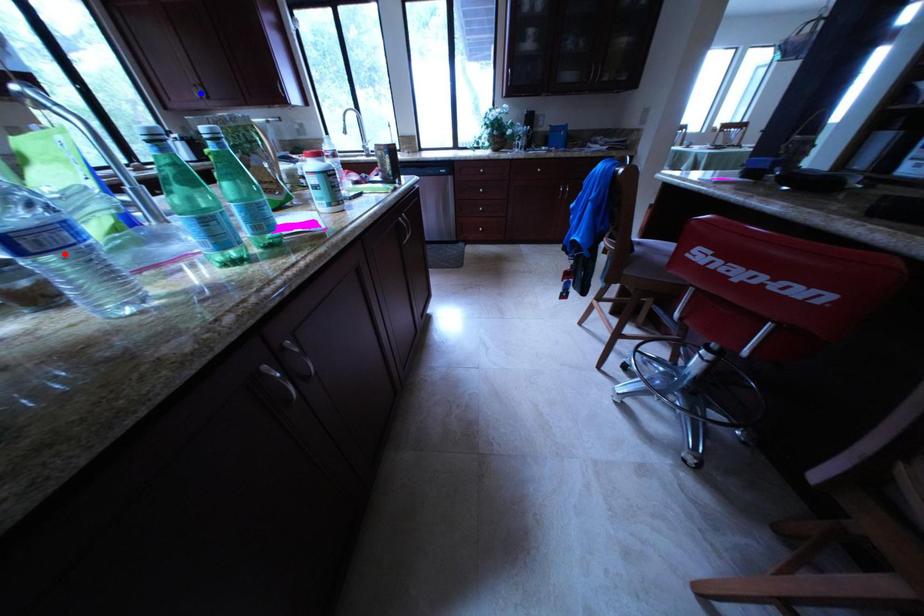
Question: Which of the two points in the image is closer to the camera?

Choices:
 (A) Blue point is closer.
 (B) Red point is closer.

Answer: (B)